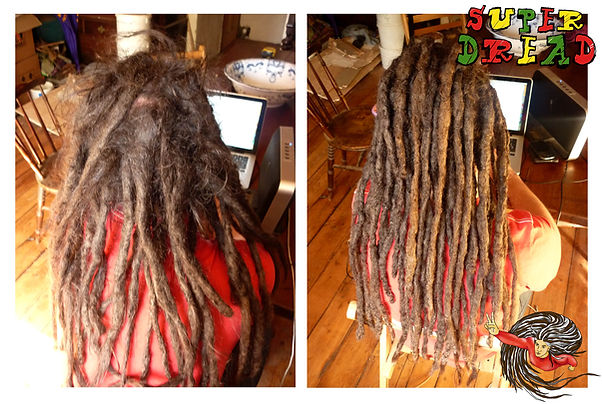
Locate an element on the screen. Image resolution: width=602 pixels, height=404 pixels. wooden floor is located at coordinates (26, 300), (330, 285).